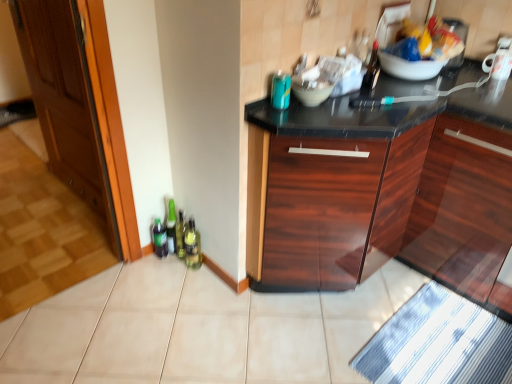
Question: From a real-world perspective, is wooden at left on top of plastic bag of chips at upper center?

Choices:
 (A) no
 (B) yes

Answer: (A)

Question: Are wooden at left and plastic bag of chips at upper center far apart?

Choices:
 (A) yes
 (B) no

Answer: (A)

Question: From the image's perspective, is wooden at left under plastic bag of chips at upper center?

Choices:
 (A) yes
 (B) no

Answer: (A)

Question: From the image's perspective, is wooden at left on top of plastic bag of chips at upper center?

Choices:
 (A) no
 (B) yes

Answer: (A)

Question: Can you confirm if wooden at left is bigger than plastic bag of chips at upper center?

Choices:
 (A) no
 (B) yes

Answer: (B)

Question: Is wooden at left outside of plastic bag of chips at upper center?

Choices:
 (A) yes
 (B) no

Answer: (A)

Question: Could blue striped bath mat at lower right be considered to be inside wooden at left?

Choices:
 (A) yes
 (B) no

Answer: (B)

Question: Is wooden at left in contact with blue striped bath mat at lower right?

Choices:
 (A) no
 (B) yes

Answer: (A)

Question: From a real-world perspective, is wooden at left under blue striped bath mat at lower right?

Choices:
 (A) no
 (B) yes

Answer: (A)

Question: Is wooden at left aimed at blue striped bath mat at lower right?

Choices:
 (A) no
 (B) yes

Answer: (A)

Question: Considering the relative sizes of wooden at left and blue striped bath mat at lower right in the image provided, is wooden at left bigger than blue striped bath mat at lower right?

Choices:
 (A) no
 (B) yes

Answer: (B)

Question: Can you confirm if wooden at left is positioned to the right of blue striped bath mat at lower right?

Choices:
 (A) no
 (B) yes

Answer: (A)

Question: Are glossy wood cabinet at center and matte white bowl at center making contact?

Choices:
 (A) no
 (B) yes

Answer: (A)